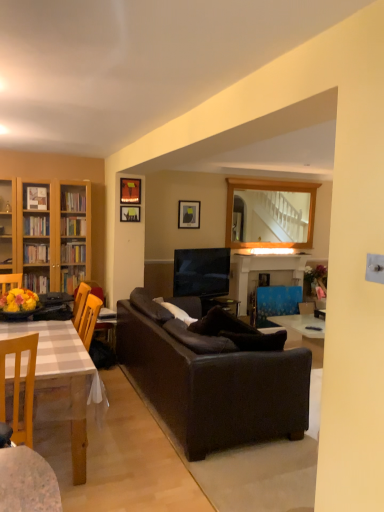
What is the approximate height of blue fabric swivel chair at center?

blue fabric swivel chair at center is 72.64 centimeters in height.

Where is `leather couch at center`? leather couch at center is located at coordinates (211, 382).

Identify the location of matte black picture frame at upper center, which is counted as the first picture frame, starting from the back. This screenshot has width=384, height=512. (189, 214).

I want to click on blue fabric swivel chair at center, so [x=276, y=303].

At what (x,y) coordinates should I click in order to perform the action: click on table on the left of the matte black picture frame at upper center, the second picture frame when ordered from right to left. Please return your answer as a coordinate pair (x, y). The width and height of the screenshot is (384, 512). Looking at the image, I should click on (61, 380).

Can you confirm if matte black picture frame at upper center, acting as the 2th picture frame starting from the left, is positioned to the right of white checkered table at left?

Correct, you'll find matte black picture frame at upper center, acting as the 2th picture frame starting from the left, to the right of white checkered table at left.

From a real-world perspective, is matte black picture frame at upper center, acting as the 2th picture frame starting from the left, physically above white checkered table at left?

Yes, from a real-world perspective, matte black picture frame at upper center, acting as the 2th picture frame starting from the left, is over white checkered table at left

Who is more distant, matte black picture frame at upper center, the 3th picture frame when ordered from back to front, or white checkered table at left?

matte black picture frame at upper center, the 3th picture frame when ordered from back to front, is further away from the camera.

Could you tell me if matte black picture frame at upper center, acting as the first picture frame starting from the right, is turned towards yellow matte flower at lower left?

No, matte black picture frame at upper center, acting as the first picture frame starting from the right, is not facing towards yellow matte flower at lower left.

Considering the relative positions of matte black picture frame at upper center, acting as the first picture frame starting from the right, and yellow matte flower at lower left in the image provided, is matte black picture frame at upper center, acting as the first picture frame starting from the right, to the right of yellow matte flower at lower left from the viewer's perspective?

Yes, matte black picture frame at upper center, acting as the first picture frame starting from the right, is to the right of yellow matte flower at lower left.

Are matte black picture frame at upper center, placed as the 3th picture frame when sorted from left to right, and yellow matte flower at lower left far apart?

matte black picture frame at upper center, placed as the 3th picture frame when sorted from left to right, is far away from yellow matte flower at lower left.

In terms of width, does matte black picture frame at upper center, placed as the 3th picture frame when sorted from left to right, look wider or thinner when compared to yellow matte flower at lower left?

matte black picture frame at upper center, placed as the 3th picture frame when sorted from left to right, is thinner than yellow matte flower at lower left.

Is white checkered table at left facing away from wooden chair at lower left?

white checkered table at left does not have its back to wooden chair at lower left.

Considering the relative positions of white checkered table at left and wooden chair at lower left in the image provided, is white checkered table at left to the left of wooden chair at lower left from the viewer's perspective?

Correct, you'll find white checkered table at left to the left of wooden chair at lower left.

Locate an element on the screen. The width and height of the screenshot is (384, 512). table beneath the wooden chair at lower left (from a real-world perspective) is located at coordinates (61, 380).

Is white checkered table at left wider or thinner than wooden chair at lower left?

In the image, white checkered table at left appears to be wider than wooden chair at lower left.

Find the location of a particular element. fireplace behind the matte black picture frame at upper center, which ranks as the 1th picture frame in front-to-back order is located at coordinates (263, 272).

Considering the positions of objects matte black picture frame at upper center, the second picture frame when ordered from right to left, and blue painted wood fireplace at center in the image provided, who is more to the left, matte black picture frame at upper center, the second picture frame when ordered from right to left, or blue painted wood fireplace at center?

matte black picture frame at upper center, the second picture frame when ordered from right to left.

Between matte black picture frame at upper center, the second picture frame when ordered from right to left, and blue painted wood fireplace at center, which one has larger size?

blue painted wood fireplace at center.

Looking at this image, from a real-world perspective, is matte black picture frame at upper center, acting as the 2th picture frame starting from the left, positioned above or below blue painted wood fireplace at center?

In terms of real-world spatial position, matte black picture frame at upper center, acting as the 2th picture frame starting from the left, is above blue painted wood fireplace at center.

From the image's perspective, is leather couch at center above or below matte black picture frame at upper center, which ranks as the second picture frame in back-to-front order?

leather couch at center is below matte black picture frame at upper center, which ranks as the second picture frame in back-to-front order.

Do you think leather couch at center is within matte black picture frame at upper center, which ranks as the second picture frame in back-to-front order, or outside of it?

leather couch at center is spatially situated outside matte black picture frame at upper center, which ranks as the second picture frame in back-to-front order.

Based on their sizes in the image, would you say leather couch at center is bigger or smaller than matte black picture frame at upper center, positioned as the third picture frame in right-to-left order?

In the image, leather couch at center appears to be larger than matte black picture frame at upper center, positioned as the third picture frame in right-to-left order.

Is leather couch at center aimed at matte black picture frame at upper center, the 1th picture frame when ordered from left to right?

No.

From the image's perspective, between matte black picture frame at upper center, which ranks as the second picture frame in back-to-front order, and wooden chair at lower left, who is located below?

From the image's view, wooden chair at lower left is below.

Relative to wooden chair at lower left, is matte black picture frame at upper center, positioned as the third picture frame in right-to-left order, in front or behind?

Visually, matte black picture frame at upper center, positioned as the third picture frame in right-to-left order, is located behind wooden chair at lower left.

Which of these two, matte black picture frame at upper center, which is the second picture frame from front to back, or wooden chair at lower left, is thinner?

matte black picture frame at upper center, which is the second picture frame from front to back.

Between matte black picture frame at upper center, which is the second picture frame from front to back, and wooden chair at lower left, which one appears on the left side from the viewer's perspective?

wooden chair at lower left.

Considering the sizes of objects matte black picture frame at upper center, which is counted as the first picture frame, starting from the back, and blue painted wood fireplace at center in the image provided, who is shorter, matte black picture frame at upper center, which is counted as the first picture frame, starting from the back, or blue painted wood fireplace at center?

matte black picture frame at upper center, which is counted as the first picture frame, starting from the back, is shorter.

From the image's perspective, is matte black picture frame at upper center, which is the 3th picture frame from front to back, over blue painted wood fireplace at center?

Yes, from the image's perspective, matte black picture frame at upper center, which is the 3th picture frame from front to back, is on top of blue painted wood fireplace at center.

From a real-world perspective, is matte black picture frame at upper center, which is the 3th picture frame from front to back, positioned over blue painted wood fireplace at center based on gravity?

Indeed, from a real-world perspective, matte black picture frame at upper center, which is the 3th picture frame from front to back, stands above blue painted wood fireplace at center.

Could you measure the distance between matte black picture frame at upper center, which is counted as the first picture frame, starting from the back, and blue painted wood fireplace at center?

They are 1.16 meters apart.

Identify the location of table located below the matte black picture frame at upper center, acting as the 2th picture frame starting from the left (from the image's perspective). This screenshot has height=512, width=384. (61, 380).

Where is `flower that appears on the left of matte black picture frame at upper center, acting as the first picture frame starting from the right`? Image resolution: width=384 pixels, height=512 pixels. flower that appears on the left of matte black picture frame at upper center, acting as the first picture frame starting from the right is located at coordinates (19, 301).

Looking at the image, which one is located further to matte black picture frame at upper center, which is the 3th picture frame from front to back, blue fabric swivel chair at center or leather couch at center?

The object further to matte black picture frame at upper center, which is the 3th picture frame from front to back, is leather couch at center.

When comparing their distances from blue fabric swivel chair at center, does leather couch at center or yellow matte flower at lower left seem further?

Based on the image, yellow matte flower at lower left appears to be further to blue fabric swivel chair at center.

Estimate the real-world distances between objects in this image. Which object is closer to wooden chair at lower left, blue fabric swivel chair at center or leather couch at center?

leather couch at center is positioned closer to the anchor wooden chair at lower left.

From the image, which object appears to be nearer to wooden mirror at upper center, blue fabric swivel chair at center or leather couch at center?

Among the two, blue fabric swivel chair at center is located nearer to wooden mirror at upper center.

When comparing their distances from yellow matte flower at lower left, does matte black picture frame at upper center, which is the second picture frame from front to back, or blue painted wood fireplace at center seem further?

blue painted wood fireplace at center is positioned further to the anchor yellow matte flower at lower left.

Estimate the real-world distances between objects in this image. Which object is closer to white checkered table at left, blue fabric swivel chair at center or matte black picture frame at upper center, the 3th picture frame when ordered from back to front?

Based on the image, matte black picture frame at upper center, the 3th picture frame when ordered from back to front, appears to be nearer to white checkered table at left.

Estimate the real-world distances between objects in this image. Which object is closer to matte black picture frame at upper center, placed as the 3th picture frame when sorted from left to right, blue fabric swivel chair at center or wooden mirror at upper center?

wooden mirror at upper center lies closer to matte black picture frame at upper center, placed as the 3th picture frame when sorted from left to right, than the other object.

Looking at the image, which one is located further to matte black picture frame at upper center, acting as the 2th picture frame starting from the left, blue fabric swivel chair at center or wooden chair at lower left?

wooden chair at lower left.

Locate an element on the screen. This screenshot has width=384, height=512. studio couch positioned between white checkered table at left and blue painted wood fireplace at center from near to far is located at coordinates (211, 382).

Image resolution: width=384 pixels, height=512 pixels. I want to click on fireplace between matte black picture frame at upper center, acting as the 2th picture frame starting from the left, and blue fabric swivel chair at center, in the horizontal direction, so click(263, 272).

The width and height of the screenshot is (384, 512). Find the location of `picture frame between leather couch at center and matte black picture frame at upper center, which is the second picture frame from front to back, in the front-back direction`. picture frame between leather couch at center and matte black picture frame at upper center, which is the second picture frame from front to back, in the front-back direction is located at coordinates (130, 191).

Where is `studio couch between white checkered table at left and wooden mirror at upper center from front to back`? The image size is (384, 512). studio couch between white checkered table at left and wooden mirror at upper center from front to back is located at coordinates (211, 382).